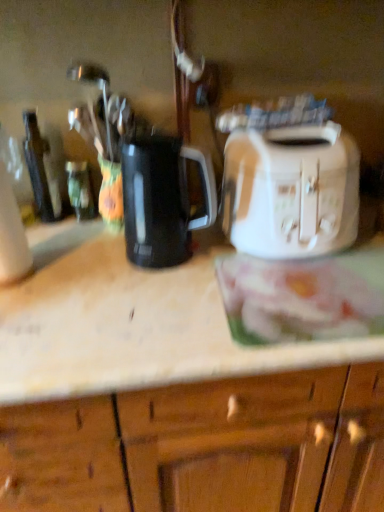
The image size is (384, 512). Identify the location of vacant area located to the right-hand side of black plastic kettle at center. (244, 272).